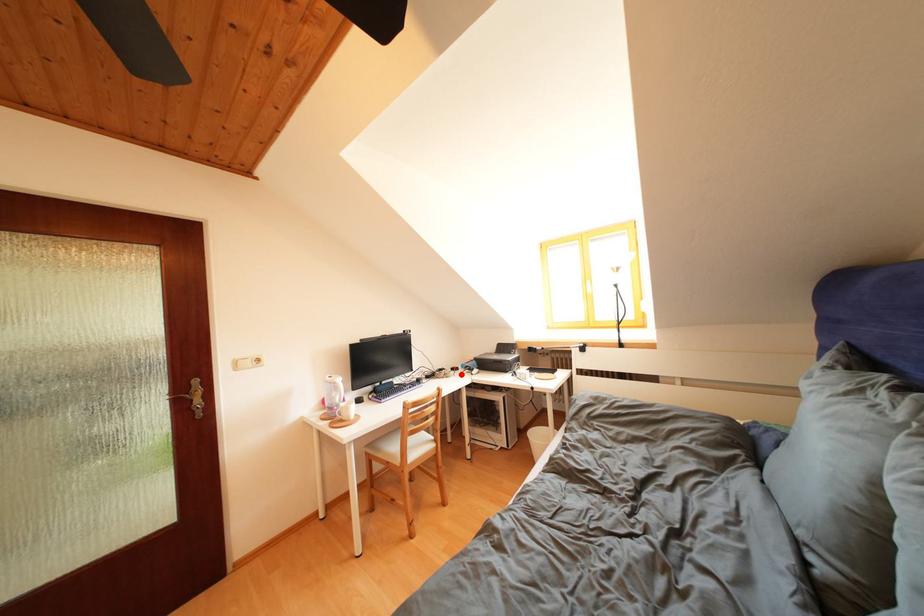
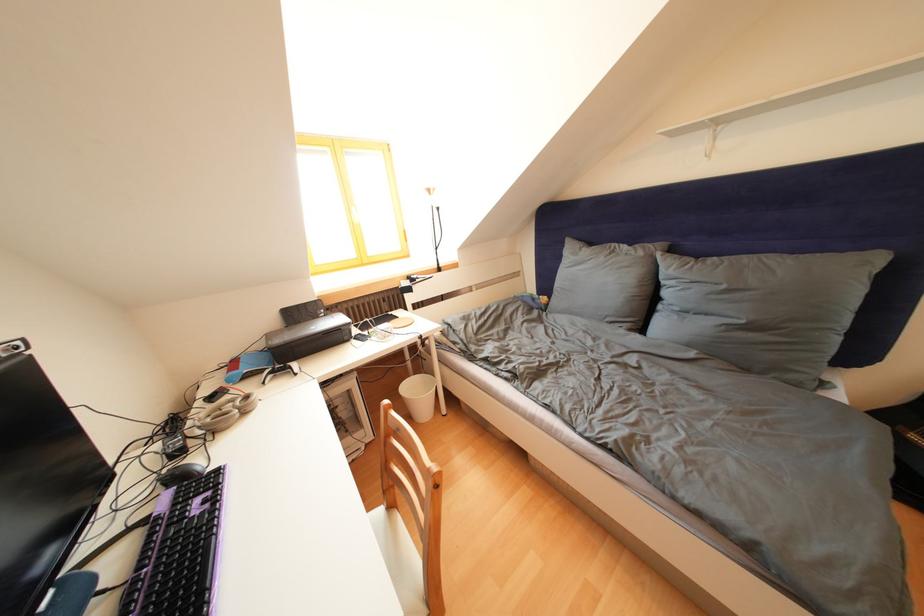
Find the pixel in the second image that matches the highlighted location in the first image.

(220, 403)